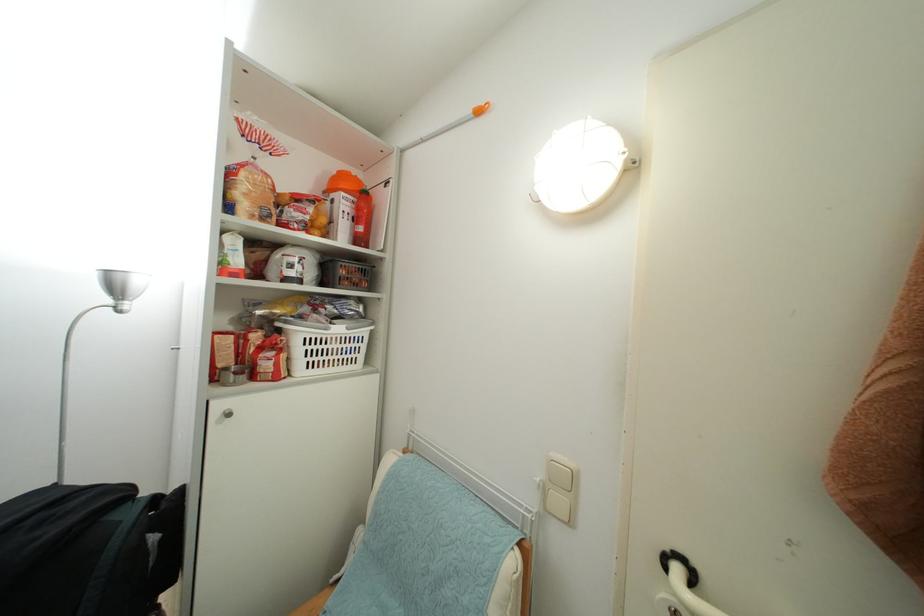
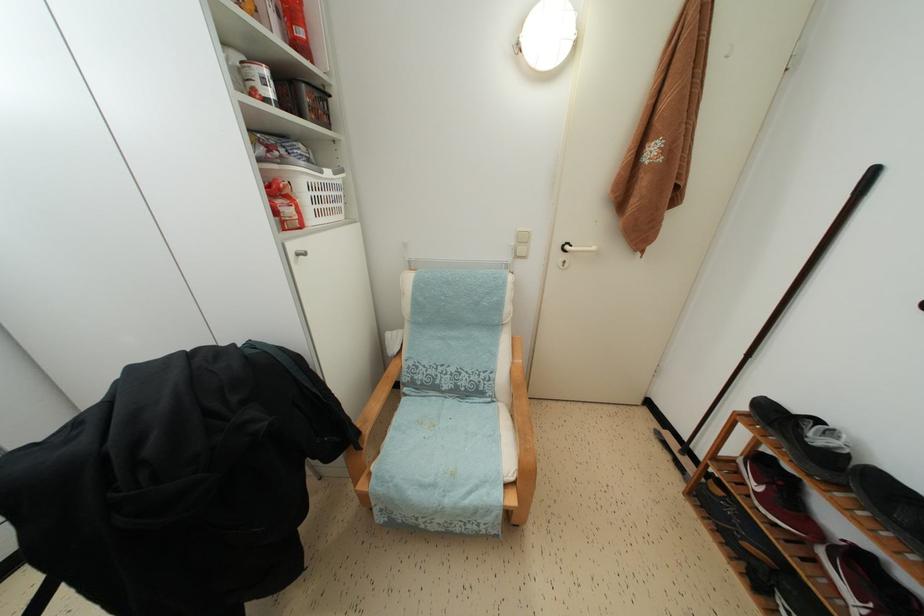
Find the pixel in the second image that matches (x=365, y=235) in the first image.

(305, 38)